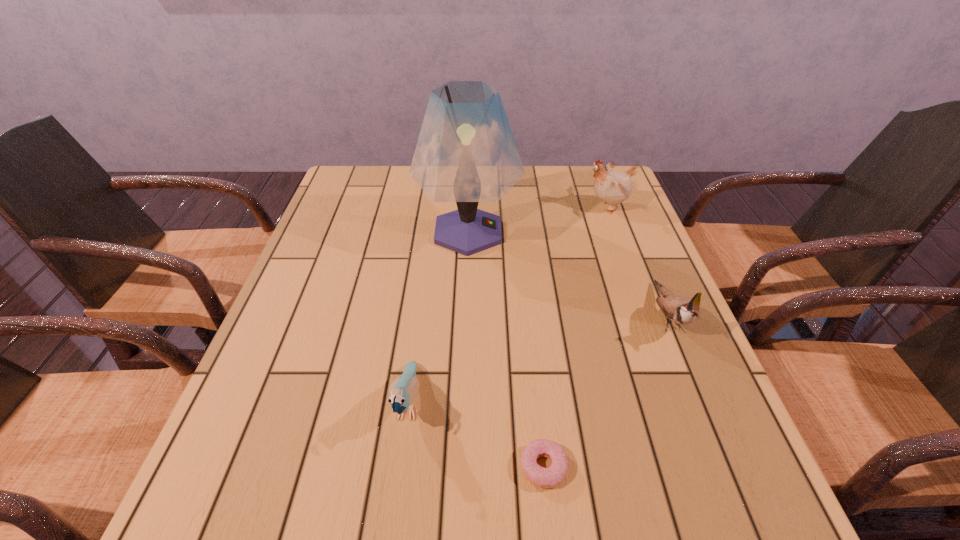
Find the location of a particular element. This screenshot has width=960, height=540. lampshade is located at coordinates (466, 153).

Where is `the farthest bird`? the farthest bird is located at coordinates (613, 188).

I want to click on the second nearest bird, so click(681, 310).

In order to click on the leftmost bird in this screenshot , I will do `click(403, 390)`.

This screenshot has width=960, height=540. In order to click on doughnut in this screenshot , I will do pyautogui.click(x=551, y=477).

Where is `vacant region located on the base of the lampshade`? The image size is (960, 540). vacant region located on the base of the lampshade is located at coordinates (571, 232).

You are a GUI agent. You are given a task and a screenshot of the screen. Output one action in this format:
    pyautogui.click(x=<x>, y=<y>)
    Task: Click on the free space located at the beak of the farthest bird
    
    Given the screenshot: What is the action you would take?
    pyautogui.click(x=454, y=207)

The height and width of the screenshot is (540, 960). What are the coordinates of `free space located 0.260m at the beak of the farthest bird` in the screenshot? It's located at (497, 207).

Image resolution: width=960 pixels, height=540 pixels. What are the coordinates of `vacant position located 0.090m at the beak of the farthest bird` in the screenshot? It's located at (554, 207).

This screenshot has height=540, width=960. I want to click on vacant space located at the face of the third nearest object, so click(x=737, y=484).